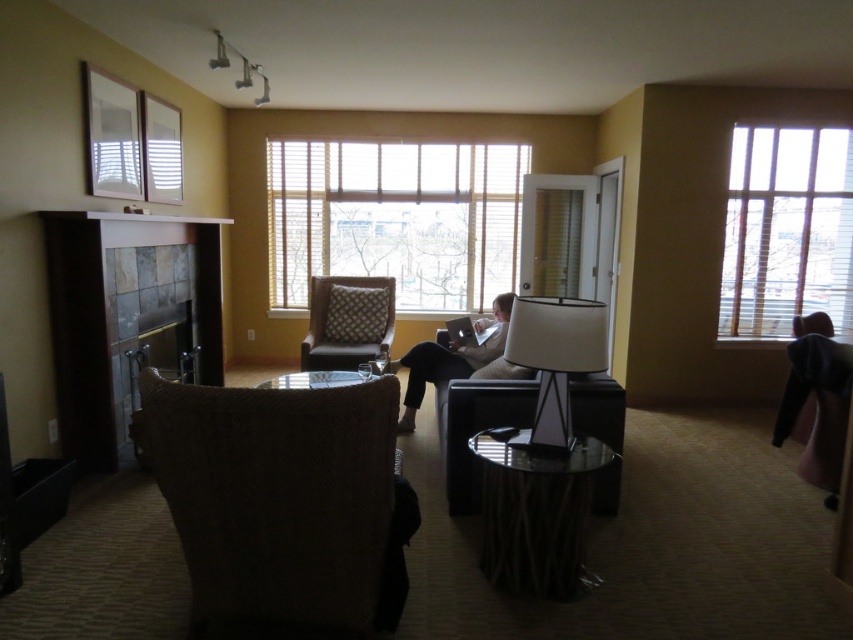
Between point (194, 524) and point (369, 317), which one is positioned in front?

Positioned in front is point (194, 524).

Can you confirm if brown woven armchair at center-left is bigger than brown textured cushioned armchair at center?

Actually, brown woven armchair at center-left might be smaller than brown textured cushioned armchair at center.

Between point (315, 445) and point (357, 356), which one is positioned in front?

Point (315, 445) is more forward.

Where is `brown woven armchair at center-left`? brown woven armchair at center-left is located at coordinates (282, 499).

Does wooden blinds at center have a greater width compared to light beige fabric couch at center?

Yes, wooden blinds at center is wider than light beige fabric couch at center.

The height and width of the screenshot is (640, 853). What do you see at coordinates (395, 218) in the screenshot? I see `wooden blinds at center` at bounding box center [395, 218].

You are a GUI agent. You are given a task and a screenshot of the screen. Output one action in this format:
    pyautogui.click(x=<x>, y=<y>)
    Task: Click on the wooden blinds at center
    The height and width of the screenshot is (640, 853).
    Given the screenshot: What is the action you would take?
    pyautogui.click(x=395, y=218)

Is point (242, 493) farther from viewer compared to point (202, 378)?

No, (242, 493) is in front of (202, 378).

Is point (173, 412) less distant than point (212, 353)?

Yes, it is in front of point (212, 353).

Does point (329, 573) lie behind point (134, 381)?

No.

Locate an element on the screen. The height and width of the screenshot is (640, 853). brown woven armchair at center-left is located at coordinates (282, 499).